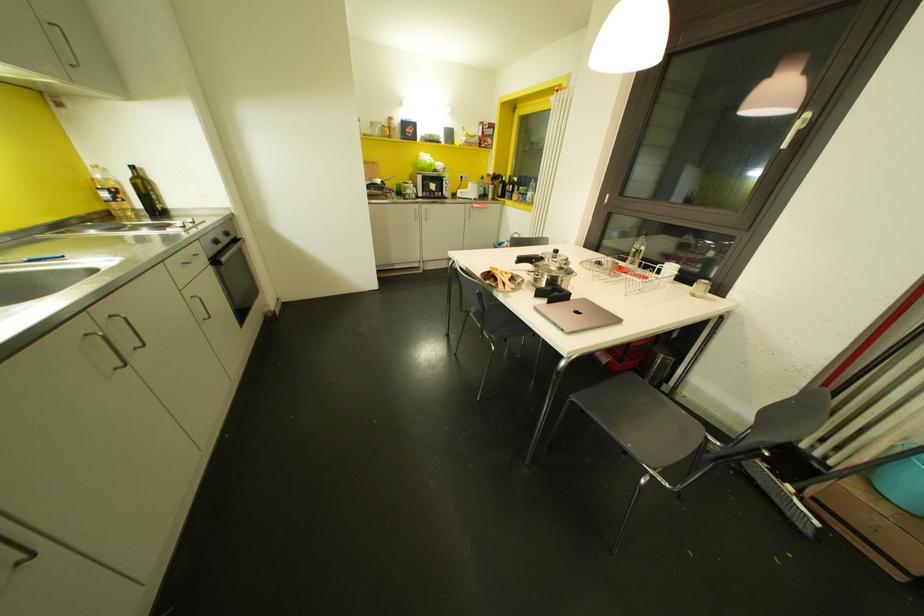
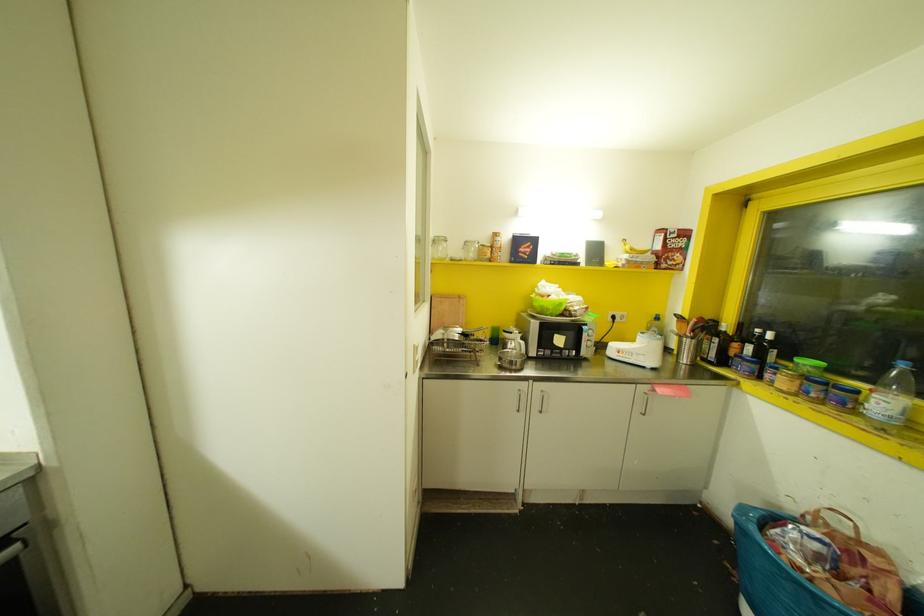
The point at (377, 132) is marked in the first image. Where is the corresponding point in the second image?

(470, 254)